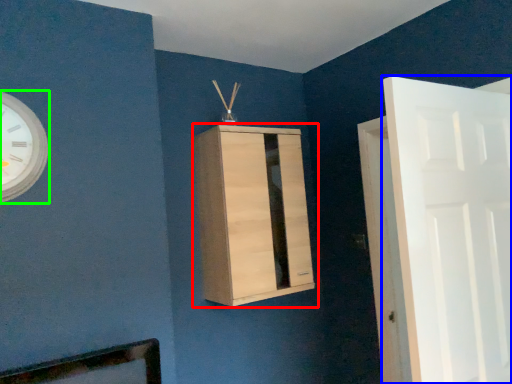
Question: Which object is positioned farthest from cupboard (highlighted by a red box)? Select from door (highlighted by a blue box) and wall clock (highlighted by a green box).

Choices:
 (A) door
 (B) wall clock

Answer: (B)